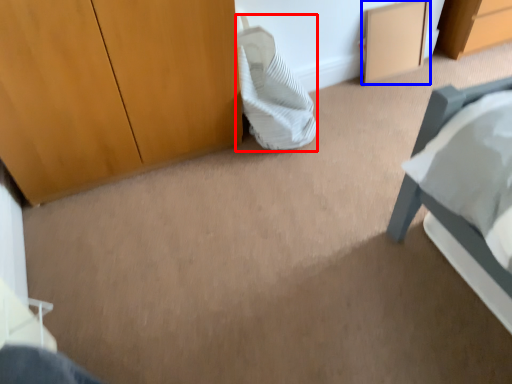
Question: Which of the following is the farthest to the observer, pillow (highlighted by a red box) or cabinetry (highlighted by a blue box)?

Choices:
 (A) pillow
 (B) cabinetry

Answer: (B)